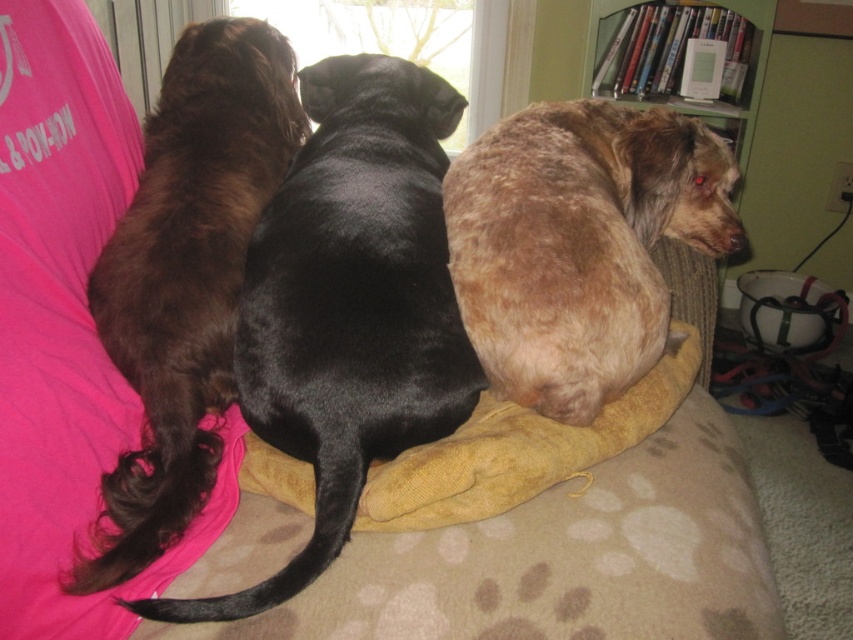
You are a photographer trying to capture a clear shot of the brown fur dog at center and the brown fuzzy dog at left. However, you notice that one of them is blocking the other. Which dog is being blocked by the other?

The brown fur dog at center is positioned under the brown fuzzy dog at left, so the brown fur dog at center is being blocked by the brown fuzzy dog at left.

You are a photographer trying to capture a group photo of the brown fur dog at center and the fuzzy brown dog at right. Since you want to ensure both dogs are clearly visible, which dog should you focus on first to account for their sizes?

The brown fur dog at center is larger in size than the fuzzy brown dog at right, so you should focus on the brown fur dog at center first to ensure its details are sharp before adjusting for the smaller one.